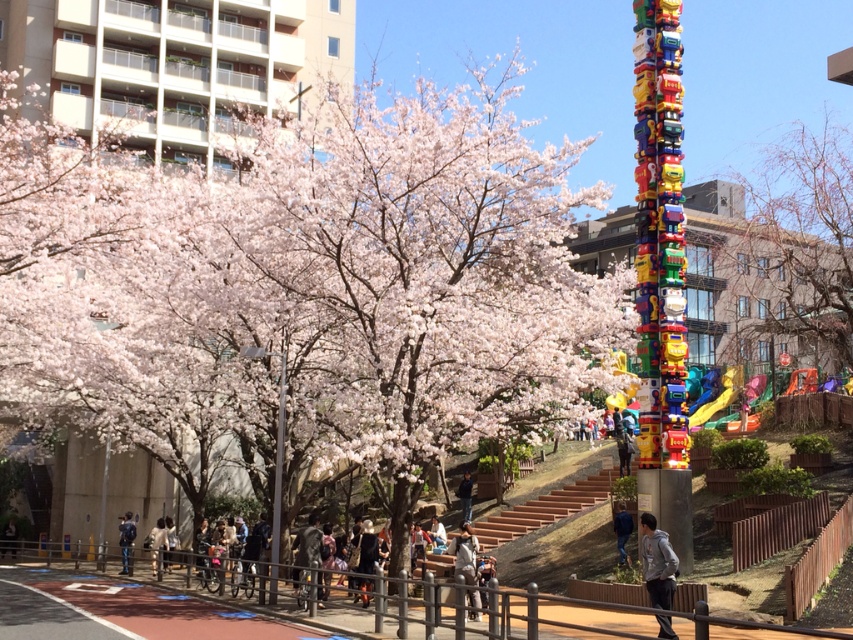
Who is shorter, blue denim jacket at lower right or dark blue jeans at center?

dark blue jeans at center is shorter.

Can you confirm if blue denim jacket at lower right is thinner than dark blue jeans at center?

In fact, blue denim jacket at lower right might be wider than dark blue jeans at center.

What are the coordinates of `blue denim jacket at lower right` in the screenshot? It's located at (622, 532).

Is bare wood playground at right wider than denim jacket at center?

Yes, bare wood playground at right is wider than denim jacket at center.

Is bare wood playground at right positioned before denim jacket at center?

No.

Is point (807, 276) behind point (460, 536)?

Yes, it is.

Locate an element on the screen. This screenshot has width=853, height=640. bare wood playground at right is located at coordinates (807, 232).

Is denim jacket at center positioned at the back of light blue denim jacket at lower center?

That is False.

Looking at this image, between denim jacket at center and light blue denim jacket at lower center, which one is positioned lower?

light blue denim jacket at lower center

Measure the distance between denim jacket at center and camera.

denim jacket at center is 25.56 meters from camera.

Locate an element on the screen. denim jacket at center is located at coordinates (465, 554).